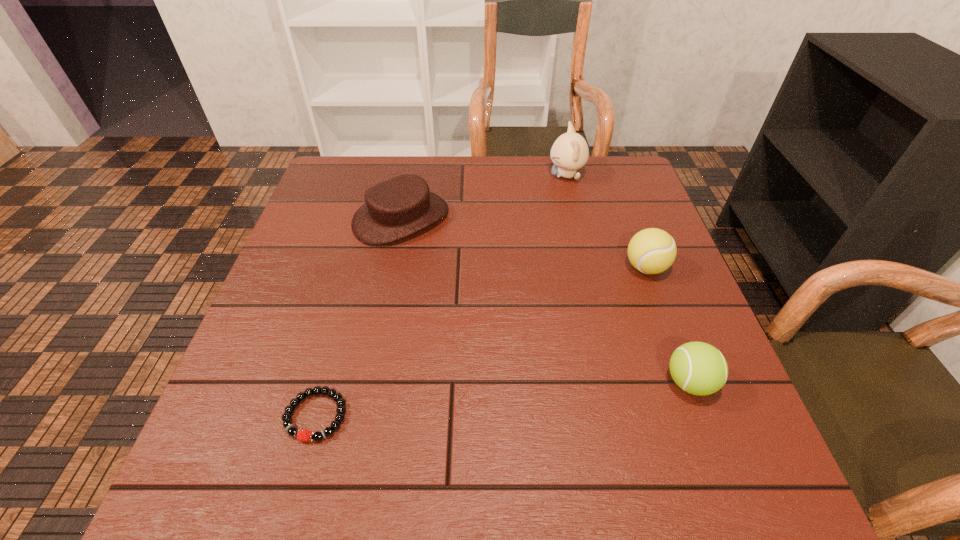
Find the location of `the tallest object`. the tallest object is located at coordinates (570, 152).

The width and height of the screenshot is (960, 540). I want to click on kitten, so pos(570,152).

This screenshot has height=540, width=960. Find the location of `the farther tennis ball`. the farther tennis ball is located at coordinates (651, 251).

Locate an element on the screen. hat is located at coordinates (403, 205).

You are a GUI agent. You are given a task and a screenshot of the screen. Output one action in this format:
    pyautogui.click(x=<x>, y=<y>)
    Task: Click on the nearer tennis ball
    
    Given the screenshot: What is the action you would take?
    pyautogui.click(x=698, y=368)

You are a GUI agent. You are given a task and a screenshot of the screen. Output one action in this format:
    pyautogui.click(x=<x>, y=<y>)
    Task: Click on the bracelet
    The width and height of the screenshot is (960, 540).
    Given the screenshot: What is the action you would take?
    pyautogui.click(x=292, y=431)

Locate an element on the screen. The height and width of the screenshot is (540, 960). vacant space located on the face of the farthest object is located at coordinates (493, 176).

Locate an element on the screen. Image resolution: width=960 pixels, height=540 pixels. vacant space located on the face of the farthest object is located at coordinates (469, 176).

I want to click on vacant space located 0.300m on the face of the farthest object, so click(x=445, y=176).

I want to click on free space located 0.370m on the left of the third farthest object, so click(465, 268).